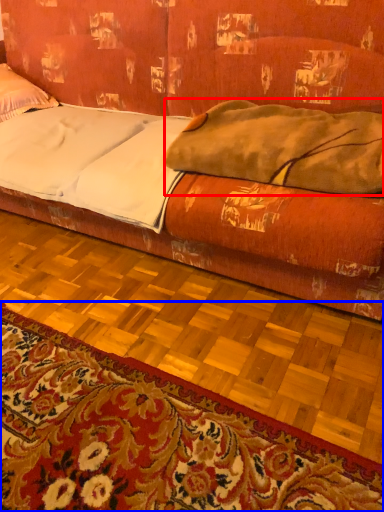
Question: Among these objects, which one is farthest to the camera, blanket (highlighted by a red box) or mat (highlighted by a blue box)?

Choices:
 (A) blanket
 (B) mat

Answer: (A)